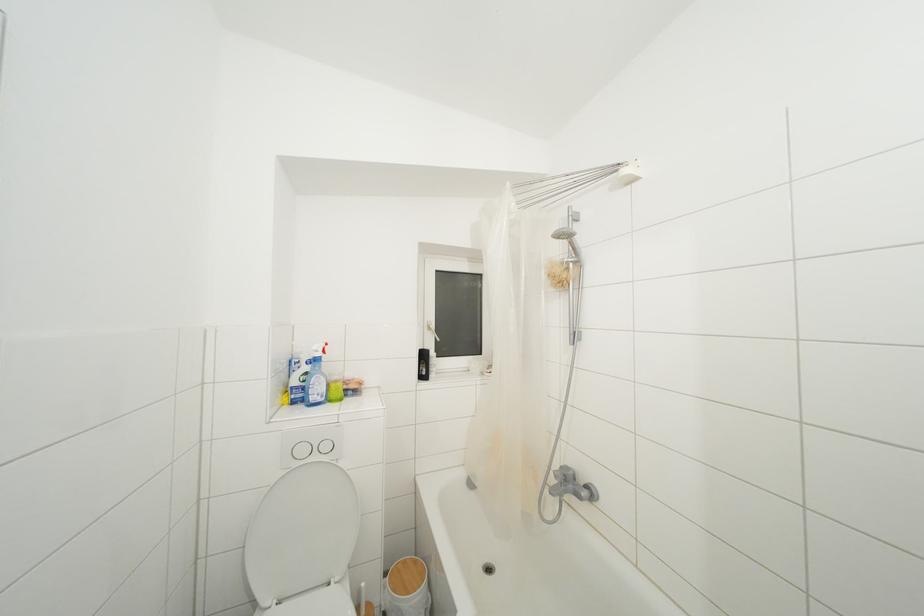
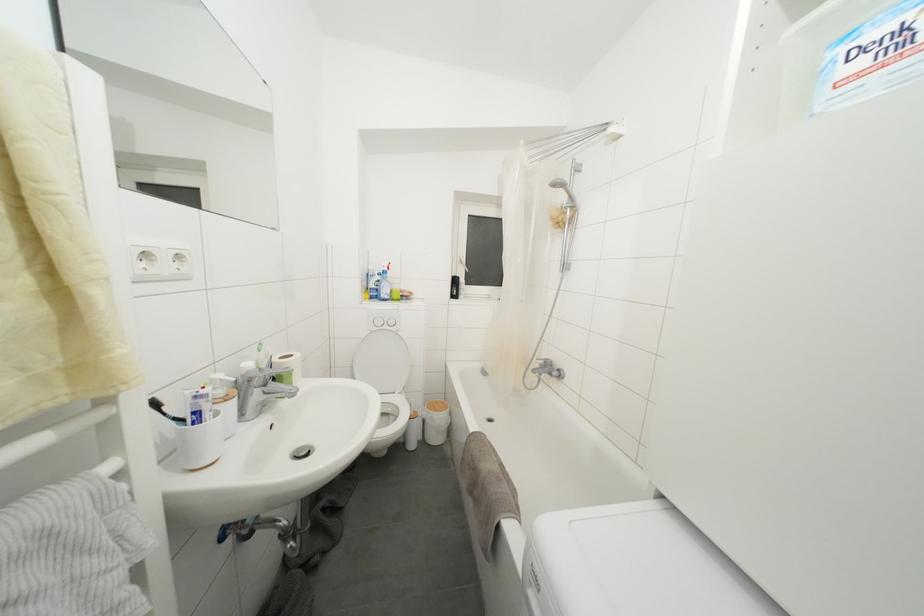
Find the pixel in the second image that matches the point at 302,402 in the first image.

(379, 300)